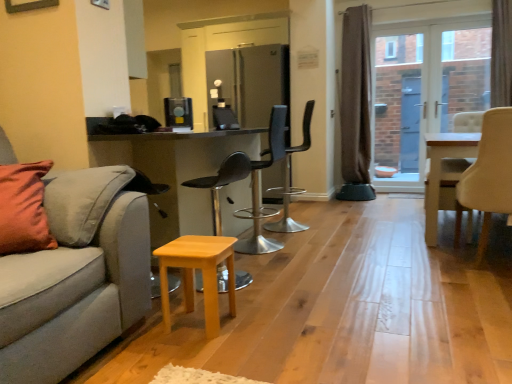
Question: Is clear glass door at center inside the boundaries of black plastic chair at center, which is counted as the second chair, starting from the left, or outside?

Choices:
 (A) outside
 (B) inside

Answer: (A)

Question: In terms of width, does clear glass door at center look wider or thinner when compared to black plastic chair at center, which is counted as the second chair, starting from the left?

Choices:
 (A) thin
 (B) wide

Answer: (A)

Question: Which is farther from the satin silver coffee machine at center, the 2th appliance when ordered from top to bottom?

Choices:
 (A) white wooden table at center
 (B) wooden stool at center, the 4th chair in the right-to-left sequence
 (C) black leather bar stool at center, which appears as the second chair when viewed from the right
 (D) brown textured curtain at right, which is the 1th curtain in back-to-front order
 (E) satin silver refrigerator at center, placed as the second appliance when sorted from left to right

Answer: (D)

Question: Estimate the real-world distances between objects in this image. Which object is closer to the light gray fabric couch at left?

Choices:
 (A) clear glass door at center
 (B) black plastic chair at center, which is counted as the second chair, starting from the left
 (C) satin silver coffee machine at center, the first appliance from the bottom
 (D) brown textured curtain at right, which is the 1th curtain in back-to-front order
 (E) black leather bar stool at center, which appears as the second chair when viewed from the right

Answer: (C)